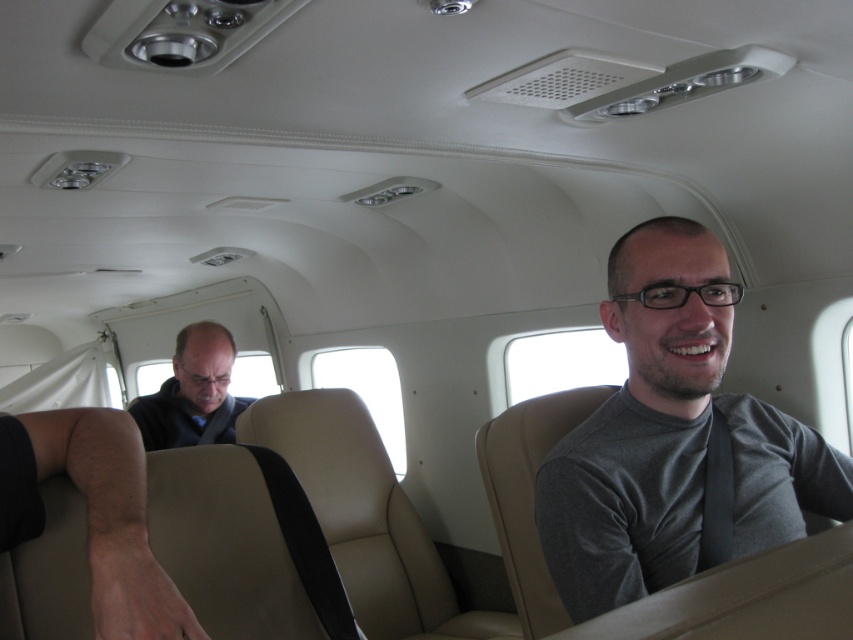
Question: Observing the image, what is the correct spatial positioning of gray matte shirt at center in reference to dark brown leather jacket at left?

Choices:
 (A) above
 (B) below

Answer: (A)

Question: Which of the following is the farthest from the observer?

Choices:
 (A) dark brown leather jacket at left
 (B) gray matte shirt at center

Answer: (A)

Question: Which of the following is the closest to the observer?

Choices:
 (A) dark brown leather jacket at left
 (B) gray matte shirt at center

Answer: (B)

Question: Which of the following is the closest to the observer?

Choices:
 (A) dark brown leather jacket at left
 (B) gray matte shirt at center

Answer: (B)

Question: Does gray matte shirt at center appear under dark brown leather jacket at left?

Choices:
 (A) yes
 (B) no

Answer: (B)

Question: Is gray matte shirt at center above dark brown leather jacket at left?

Choices:
 (A) yes
 (B) no

Answer: (A)